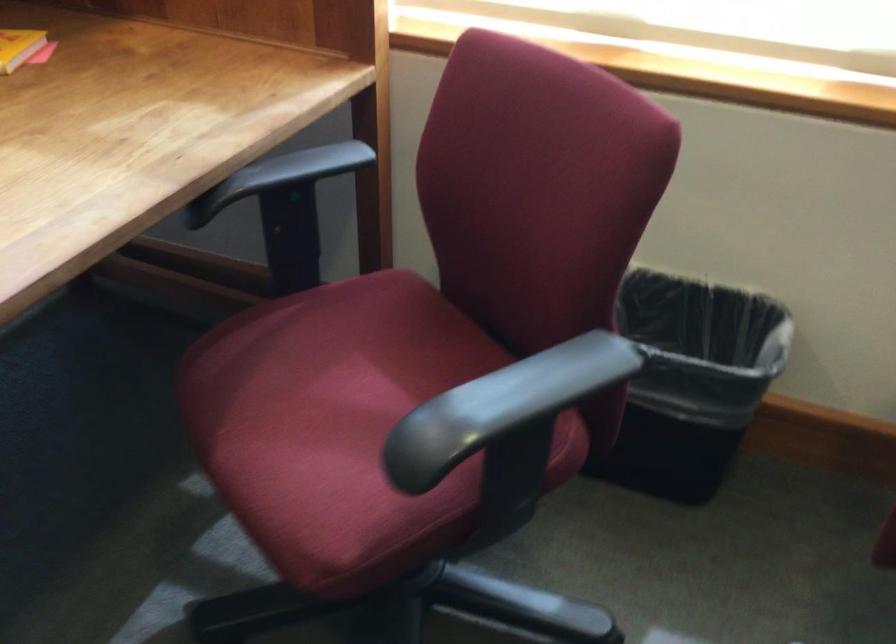
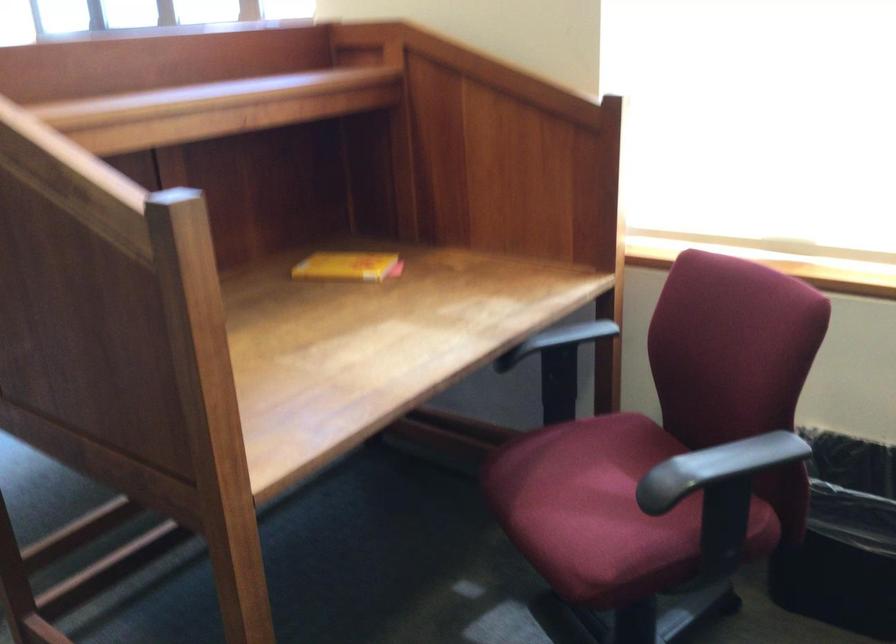
The point at (277,174) is marked in the first image. Where is the corresponding point in the second image?

(556, 339)